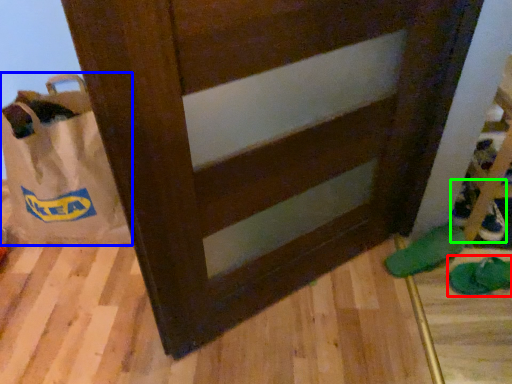
Question: Which object is the farthest from footwear (highlighted by a red box)? Choose among these: grocery bag (highlighted by a blue box) or shoe (highlighted by a green box).

Choices:
 (A) grocery bag
 (B) shoe

Answer: (A)